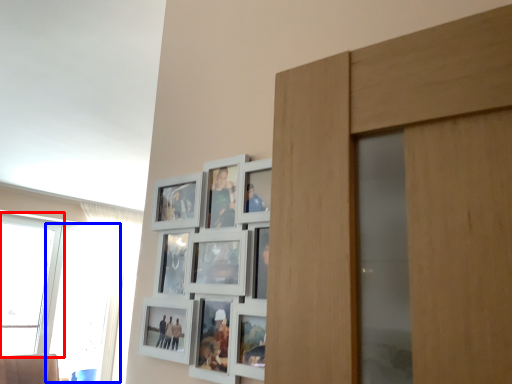
Question: Which of the following is the farthest to the observer, window (highlighted by a red box) or window (highlighted by a blue box)?

Choices:
 (A) window
 (B) window

Answer: (B)